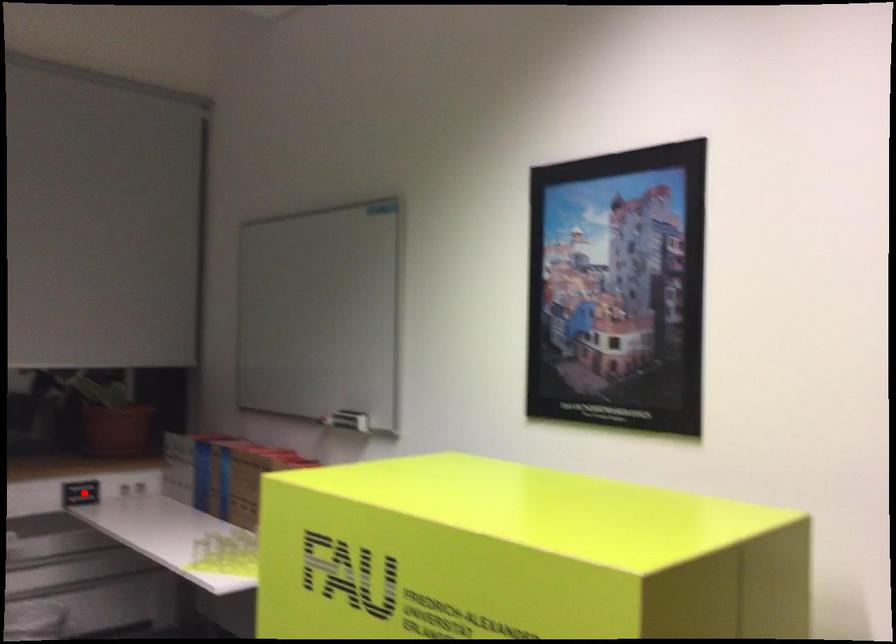
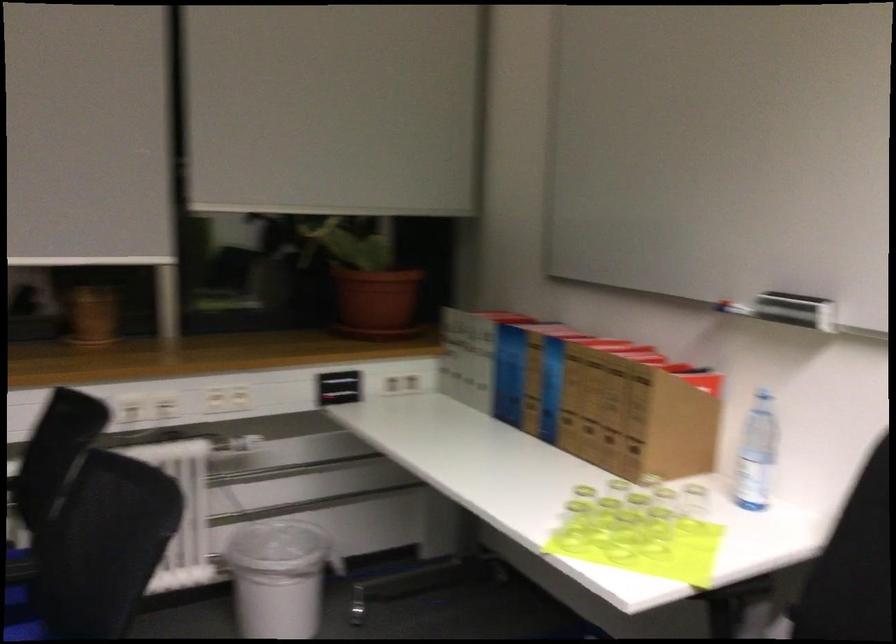
Question: I am providing you with two images of the same scene from different viewpoints. Image1 has a red point marked. In image2, the corresponding 3D location appears at what relative position? Reply with the corresponding letter.

Choices:
 (A) Closer
 (B) Farther

Answer: (A)